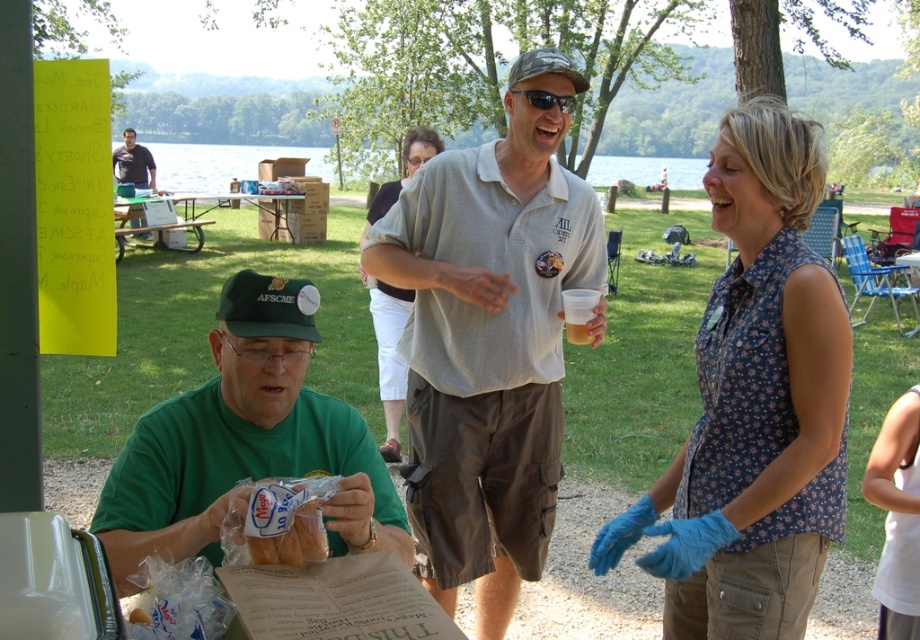
You are a photographer standing at the edge of the lake, and you want to take a picture that includes both the dark gray shirt at upper left and the translucent plastic cup at center. Which object should you focus on first to ensure both are in frame?

The dark gray shirt at upper left is much taller than the translucent plastic cup at center, so you should focus on the dark gray shirt at upper left first to ensure both are in frame.

You are a photographer standing at the edge of the lake, and you want to take a picture of the dark gray shirt at upper left and the translucent plastic cup at center. Which object should you adjust your camera focus to first to ensure both are in frame?

The dark gray shirt at upper left is positioned on the left side of the translucent plastic cup at center. Since the photographer needs to ensure both are in frame, they should first focus on the translucent plastic cup at center as it is centrally located and adjust the frame to include the dark gray shirt at upper left to the left of it.

You are standing at the point labeled point (136, 513) and want to walk to the point labeled point (387, 317). Which direction should you move?

You should move backward because point (136, 513) is in front of point (387, 317).